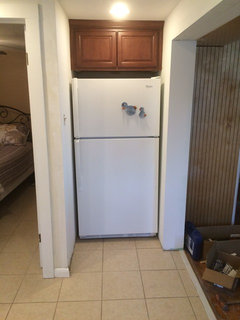
This screenshot has height=320, width=240. In order to click on ceiling in this screenshot , I will do `click(12, 37)`, `click(82, 11)`.